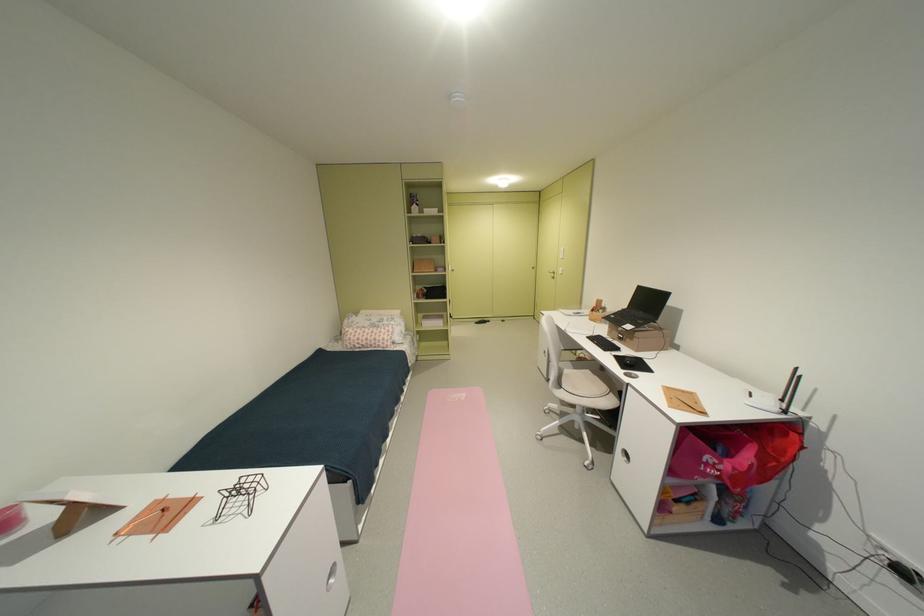
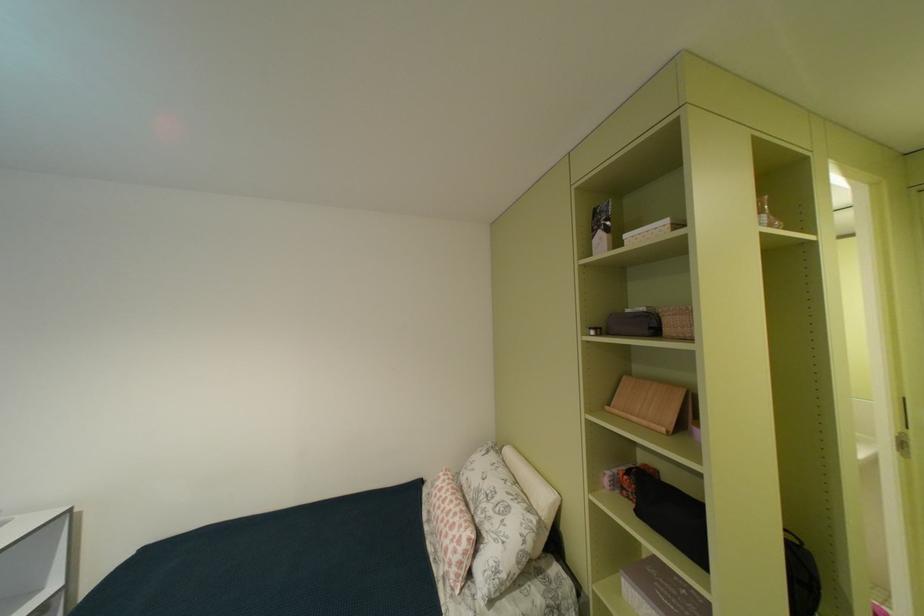
Locate, in the second image, the point that corresponds to the point at 442,243 in the first image.

(675, 331)